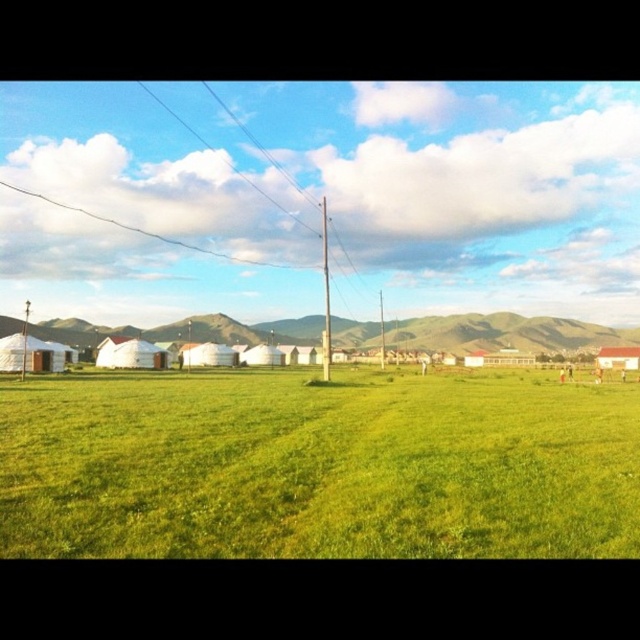
Question: Which object is farther from the camera taking this photo?

Choices:
 (A) green grassy field at lower center
 (B) green grassy field at center
 (C) white fabric tent at center
 (D) metallic pole at center

Answer: (A)

Question: Is the position of green grassy field at center less distant than that of green grassy field at lower center?

Choices:
 (A) yes
 (B) no

Answer: (A)

Question: Is the position of white fabric tent at center more distant than that of white matte hut at lower right?

Choices:
 (A) yes
 (B) no

Answer: (B)

Question: Among these points, which one is nearest to the camera?

Choices:
 (A) (284, 435)
 (B) (118, 349)
 (C) (324, 289)

Answer: (A)

Question: Observing the image, what is the correct spatial positioning of green grassy field at center in reference to white fabric tent at center?

Choices:
 (A) below
 (B) above

Answer: (A)

Question: Which point appears closest to the camera in this image?

Choices:
 (A) (13, 328)
 (B) (131, 344)

Answer: (B)